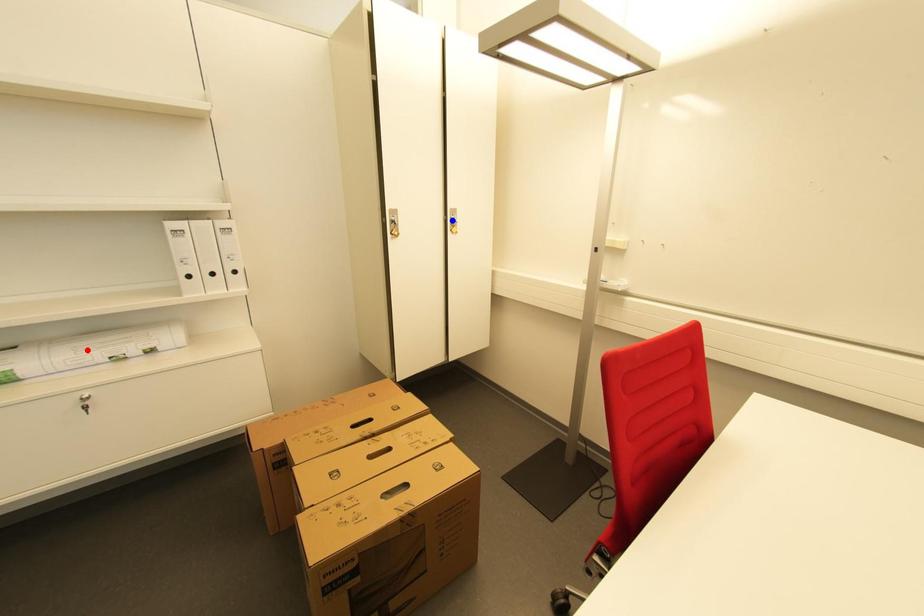
Question: Two points are marked on the image. Which point is closer to the camera?

Choices:
 (A) Blue point is closer.
 (B) Red point is closer.

Answer: (B)